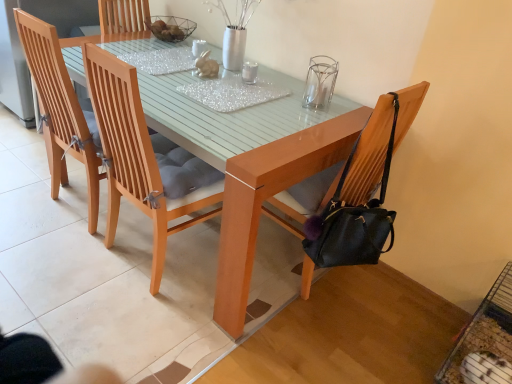
At what (x,y) coordinates should I click in order to perform the action: click on free spot to the right of transparent glass candle holder at upper center. Please return your answer as a coordinate pair (x, y). Image resolution: width=512 pixels, height=384 pixels. Looking at the image, I should click on 345,107.